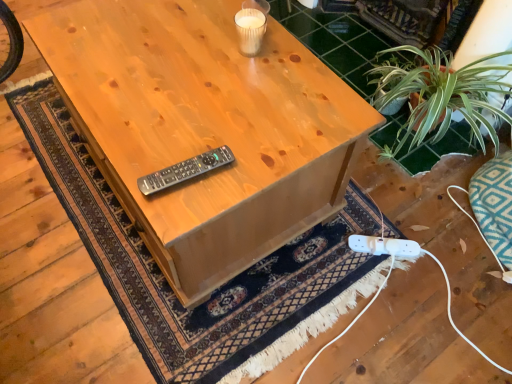
Identify the location of free space in front of black plastic remote at center. Image resolution: width=512 pixels, height=384 pixels. (179, 205).